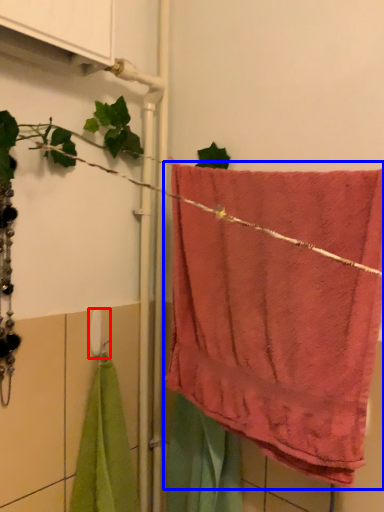
Question: Which object is closer to the camera taking this photo, towel bar (highlighted by a red box) or towel (highlighted by a blue box)?

Choices:
 (A) towel bar
 (B) towel

Answer: (B)